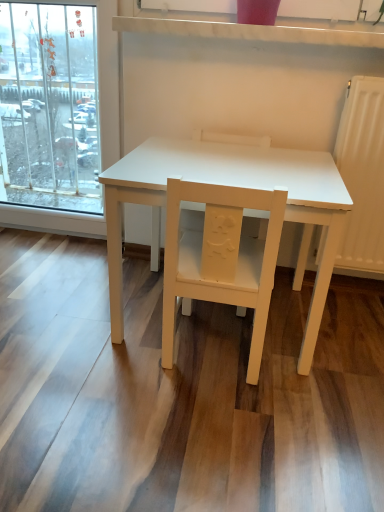
Question: In which direction should I rotate to look at white matte chair at center, the 1th chair viewed from the back?

Choices:
 (A) right
 (B) left

Answer: (A)

Question: Considering the relative sizes of matte yellow chair at center, arranged as the second chair when viewed from the back, and white matte table at center in the image provided, is matte yellow chair at center, arranged as the second chair when viewed from the back, taller than white matte table at center?

Choices:
 (A) yes
 (B) no

Answer: (B)

Question: Is there a large distance between matte yellow chair at center, the 1th chair positioned from the front, and white matte table at center?

Choices:
 (A) no
 (B) yes

Answer: (A)

Question: Does matte yellow chair at center, arranged as the second chair when viewed from the back, have a lesser height compared to white matte table at center?

Choices:
 (A) yes
 (B) no

Answer: (A)

Question: Does matte yellow chair at center, arranged as the second chair when viewed from the back, touch white matte table at center?

Choices:
 (A) no
 (B) yes

Answer: (A)

Question: From the image's perspective, is matte yellow chair at center, the 1th chair positioned from the front, located above white matte table at center?

Choices:
 (A) no
 (B) yes

Answer: (A)

Question: Considering the relative sizes of matte yellow chair at center, arranged as the second chair when viewed from the back, and white matte table at center in the image provided, is matte yellow chair at center, arranged as the second chair when viewed from the back, bigger than white matte table at center?

Choices:
 (A) yes
 (B) no

Answer: (B)

Question: Is white matte table at center positioned far away from white matte chair at center, the 1th chair viewed from the back?

Choices:
 (A) no
 (B) yes

Answer: (A)

Question: Is white matte table at center next to white matte chair at center, the 1th chair viewed from the back?

Choices:
 (A) no
 (B) yes

Answer: (A)

Question: Does white matte table at center appear on the right side of white matte chair at center, which appears as the 2th chair when viewed from the front?

Choices:
 (A) yes
 (B) no

Answer: (A)

Question: Can we say white matte table at center lies outside white matte chair at center, the 1th chair viewed from the back?

Choices:
 (A) no
 (B) yes

Answer: (B)

Question: Is white matte table at center positioned with its back to white matte chair at center, the 1th chair viewed from the back?

Choices:
 (A) yes
 (B) no

Answer: (A)

Question: Can you confirm if white matte table at center is bigger than white matte chair at center, which appears as the 2th chair when viewed from the front?

Choices:
 (A) yes
 (B) no

Answer: (A)

Question: Could you tell me if matte yellow chair at center, the 1th chair positioned from the front, is facing white matte chair at center, the 1th chair viewed from the back?

Choices:
 (A) yes
 (B) no

Answer: (A)